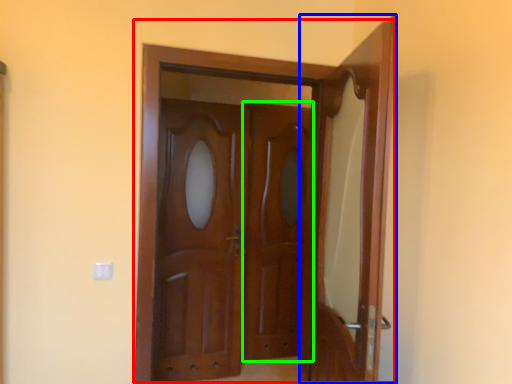
Question: Which object is the farthest from door (highlighted by a red box)? Choose among these: door (highlighted by a blue box) or screen door (highlighted by a green box).

Choices:
 (A) door
 (B) screen door

Answer: (B)